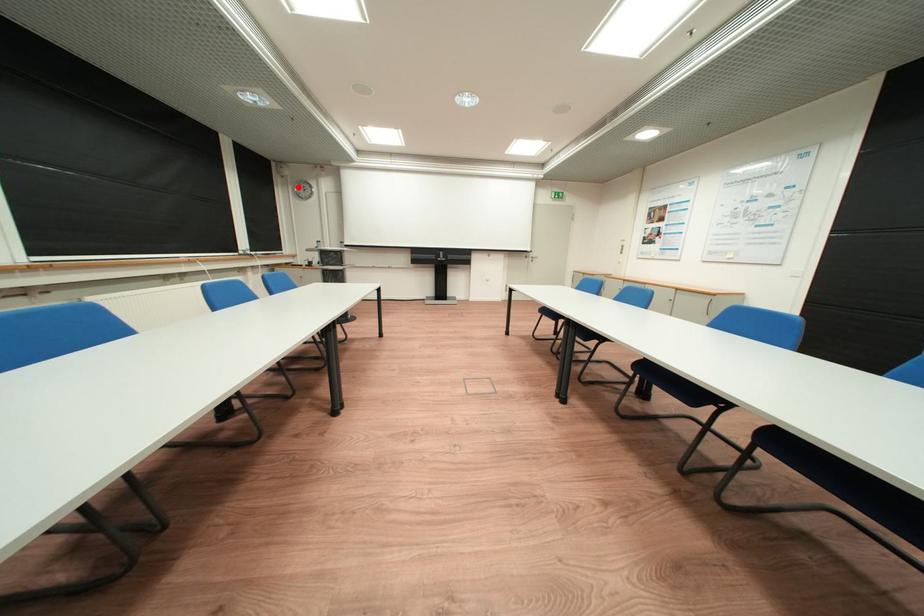
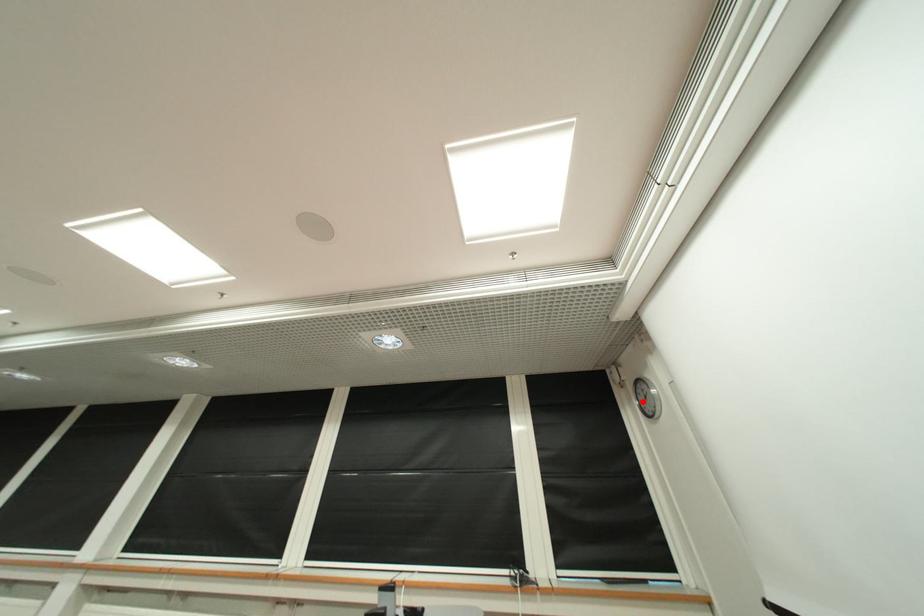
I am providing you with two images of the same scene from different viewpoints. A red point is marked on the first image and another point is marked on the second image. Does the point marked in image1 correspond to the same location as the one in image2?

Yes